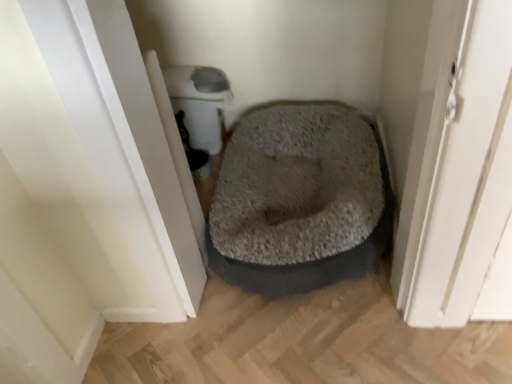
Identify the location of vacant space in front of white glossy screen door at left. (214, 301).